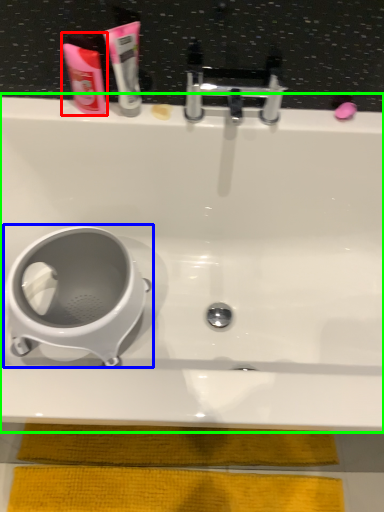
Question: Estimate the real-world distances between objects in this image. Which object is farther from mouthwash (highlighted by a red box), toilet (highlighted by a blue box) or bathtub (highlighted by a green box)?

Choices:
 (A) toilet
 (B) bathtub

Answer: (A)